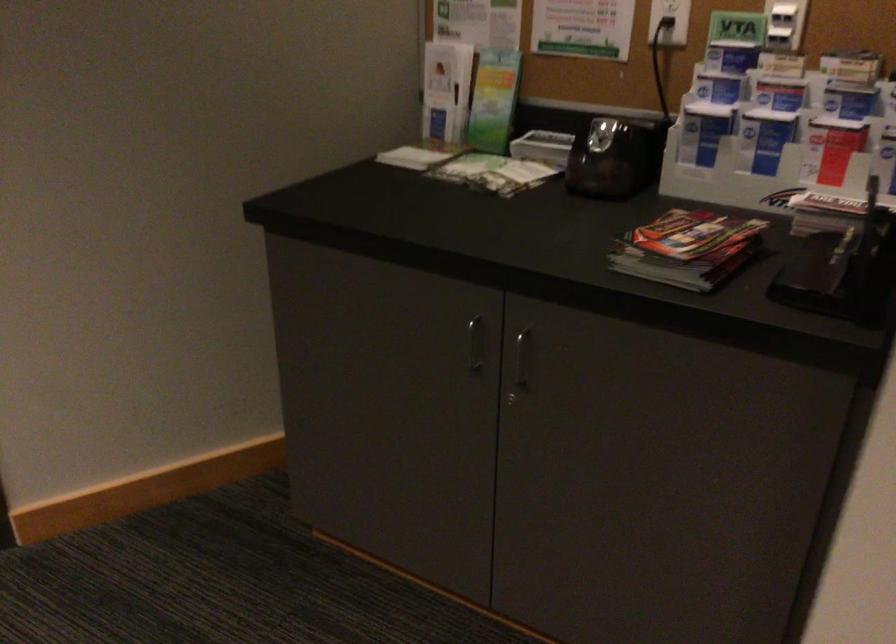
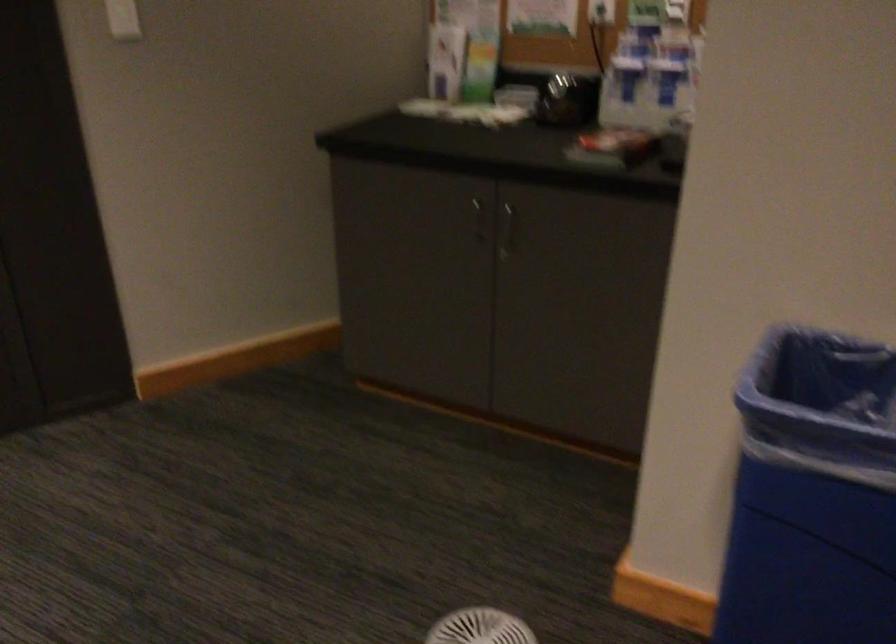
Question: In a continuous first-person perspective shot, in which direction is the camera moving?

Choices:
 (A) Left
 (B) Right
 (C) Forward
 (D) Backward

Answer: (D)